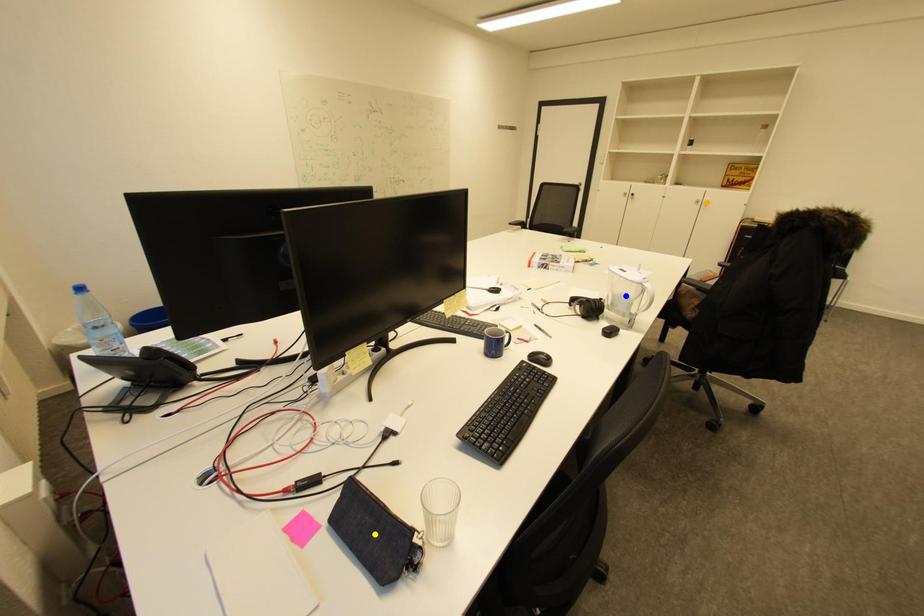
Looking at this image, order these from nearest to farthest:
orange point | blue point | yellow point

yellow point < blue point < orange point